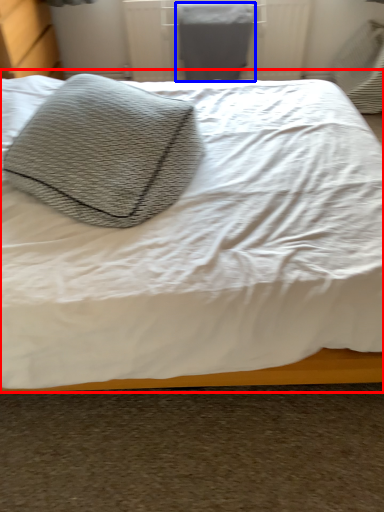
Question: Which object appears farthest to the camera in this image, bed (highlighted by a red box) or gray (highlighted by a blue box)?

Choices:
 (A) bed
 (B) gray

Answer: (B)